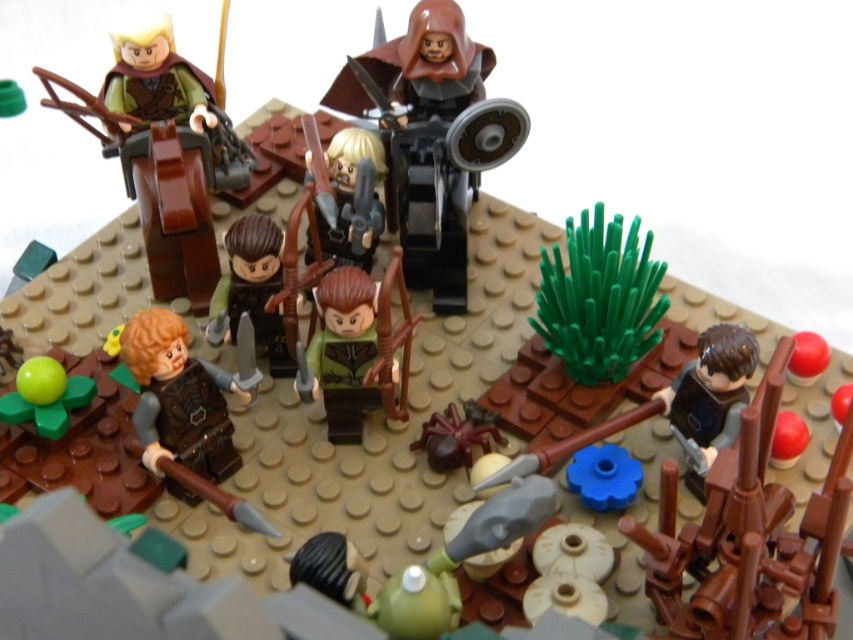
Is brown matte sword at lower right positioned at the back of brown matte helmet at center?

No, it is not.

Does brown matte sword at lower right have a smaller size compared to brown matte helmet at center?

Yes, brown matte sword at lower right is smaller than brown matte helmet at center.

The width and height of the screenshot is (853, 640). What do you see at coordinates (750, 538) in the screenshot? I see `brown matte sword at lower right` at bounding box center [750, 538].

Identify the location of brown matte sword at lower right. The image size is (853, 640). (750, 538).

Does brown matte helmet at center have a greater height compared to green matte minifigure at center?

Yes.

Does brown matte helmet at center lie behind green matte minifigure at center?

Yes, it is behind green matte minifigure at center.

Does point (480, 145) come in front of point (337, 362)?

No.

This screenshot has width=853, height=640. I want to click on brown matte helmet at center, so click(431, 138).

Which is more to the right, brown matte helmet at center or matte brown horse at upper left?

brown matte helmet at center

Identify the location of brown matte helmet at center. Image resolution: width=853 pixels, height=640 pixels. (431, 138).

Where is `brown matte helmet at center`? The width and height of the screenshot is (853, 640). brown matte helmet at center is located at coordinates (431, 138).